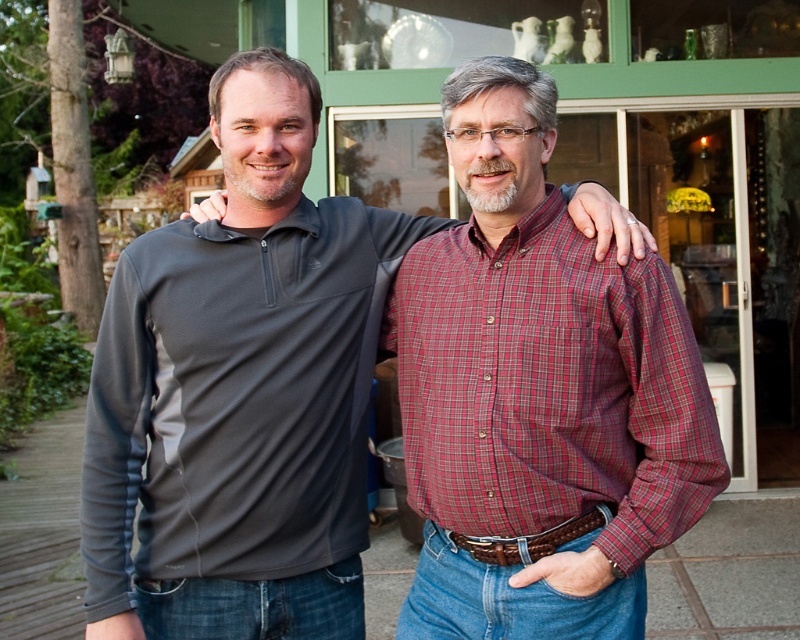
Is gray fleece pullover at center in front of plaid cotton shirt at center?

No, it is behind plaid cotton shirt at center.

Can you confirm if gray fleece pullover at center is positioned above plaid cotton shirt at center?

Yes.

This screenshot has height=640, width=800. Describe the element at coordinates (240, 392) in the screenshot. I see `gray fleece pullover at center` at that location.

Locate an element on the screen. This screenshot has width=800, height=640. gray fleece pullover at center is located at coordinates (240, 392).

Is plaid cotton shirt at center to the left of brown leather belt at center from the viewer's perspective?

In fact, plaid cotton shirt at center is to the right of brown leather belt at center.

Is point (462, 284) positioned before point (576, 518)?

No.

Identify the location of plaid cotton shirt at center. The height and width of the screenshot is (640, 800). (550, 387).

Can you confirm if gray fleece pullover at center is positioned below brown leather belt at center?

No.

Who is positioned more to the right, gray fleece pullover at center or brown leather belt at center?

Result: From the viewer's perspective, brown leather belt at center appears more on the right side.

Who is more distant from viewer, (140, 243) or (486, 554)?

The point (140, 243) is behind.

Locate an element on the screen. gray fleece pullover at center is located at coordinates (240, 392).